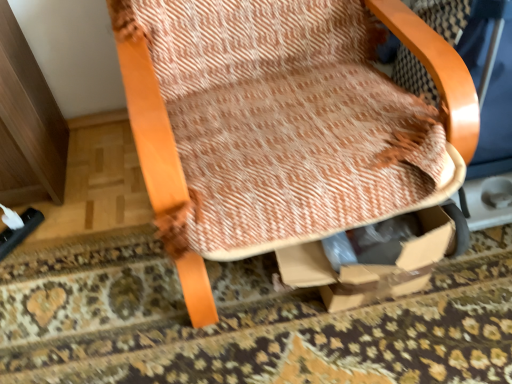
Question: Considering the relative sizes of wooden textured chair at center and textured beige rug at center in the image provided, is wooden textured chair at center smaller than textured beige rug at center?

Choices:
 (A) no
 (B) yes

Answer: (A)

Question: From the image's perspective, would you say wooden textured chair at center is shown under textured beige rug at center?

Choices:
 (A) no
 (B) yes

Answer: (A)

Question: Is wooden textured chair at center positioned beyond the bounds of textured beige rug at center?

Choices:
 (A) no
 (B) yes

Answer: (B)

Question: Is wooden textured chair at center surrounding textured beige rug at center?

Choices:
 (A) yes
 (B) no

Answer: (B)

Question: Is wooden textured chair at center beside textured beige rug at center?

Choices:
 (A) no
 (B) yes

Answer: (A)

Question: Is wooden textured chair at center positioned far away from textured beige rug at center?

Choices:
 (A) no
 (B) yes

Answer: (A)

Question: Is the depth of textured beige rug at center greater than that of wooden textured chair at center?

Choices:
 (A) no
 (B) yes

Answer: (B)

Question: Is textured beige rug at center far from wooden textured chair at center?

Choices:
 (A) yes
 (B) no

Answer: (B)

Question: Could you tell me if textured beige rug at center is facing wooden textured chair at center?

Choices:
 (A) no
 (B) yes

Answer: (B)

Question: Is the surface of textured beige rug at center in direct contact with wooden textured chair at center?

Choices:
 (A) no
 (B) yes

Answer: (A)

Question: From a real-world perspective, does textured beige rug at center stand above wooden textured chair at center?

Choices:
 (A) no
 (B) yes

Answer: (A)

Question: Considering the relative sizes of textured beige rug at center and wooden textured chair at center in the image provided, is textured beige rug at center shorter than wooden textured chair at center?

Choices:
 (A) no
 (B) yes

Answer: (B)

Question: Is point (460, 125) closer or farther from the camera than point (456, 283)?

Choices:
 (A) farther
 (B) closer

Answer: (B)